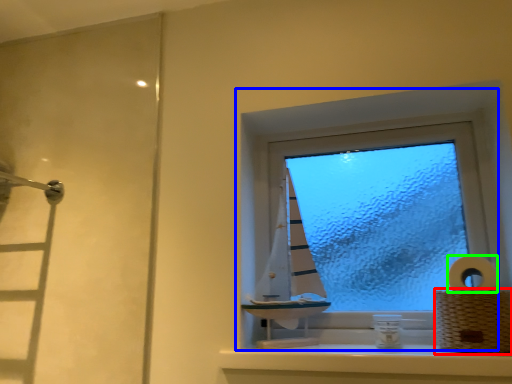
Question: Which object is the farthest from basket (highlighted by a red box)? Choose among these: window (highlighted by a blue box) or toilet paper (highlighted by a green box).

Choices:
 (A) window
 (B) toilet paper

Answer: (A)